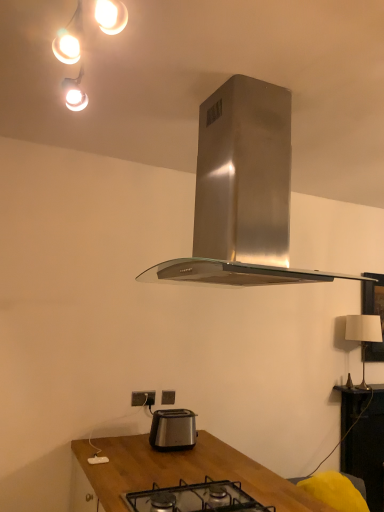
Question: Considering the positions of white fabric lampshade at right and black glass gas stove at center in the image, is white fabric lampshade at right wider or thinner than black glass gas stove at center?

Choices:
 (A) wide
 (B) thin

Answer: (B)

Question: Is point (350, 317) positioned closer to the camera than point (236, 481)?

Choices:
 (A) closer
 (B) farther

Answer: (B)

Question: Which object is positioned closest to the white plastic power plugs and sockets at lower center, acting as the first power plugs and sockets starting from the left?

Choices:
 (A) satin silver power plugs and sockets at lower center, which appears as the first power plugs and sockets when viewed from the back
 (B) matte white lights at upper left
 (C) wooden table at lower right
 (D) black glass gas stove at center
 (E) satin silver toaster at lower center

Answer: (A)

Question: Estimate the real-world distances between objects in this image. Which object is closer to the white fabric lampshade at right?

Choices:
 (A) matte white lights at upper left
 (B) satin silver power plugs and sockets at lower center, marked as the 1th power plugs and sockets in a right-to-left arrangement
 (C) white plastic power plugs and sockets at lower center, acting as the first power plugs and sockets starting from the left
 (D) wooden table at lower right
 (E) stainless steel range hood at center

Answer: (D)